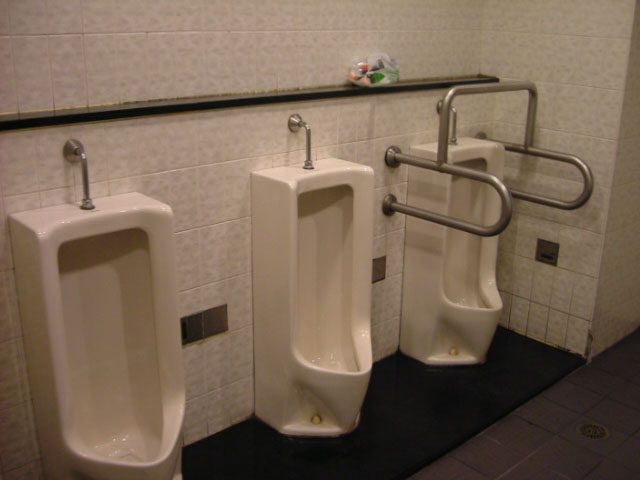
At what (x,y) coordinates should I click in order to perform the action: click on bathroom urinals - tops, middles, bottoms. Please return your answer as a coordinate pair (x, y). Looking at the image, I should click on (125, 357), (329, 289), (468, 253), (104, 221), (332, 181), (484, 147), (480, 336), (344, 387), (152, 456).